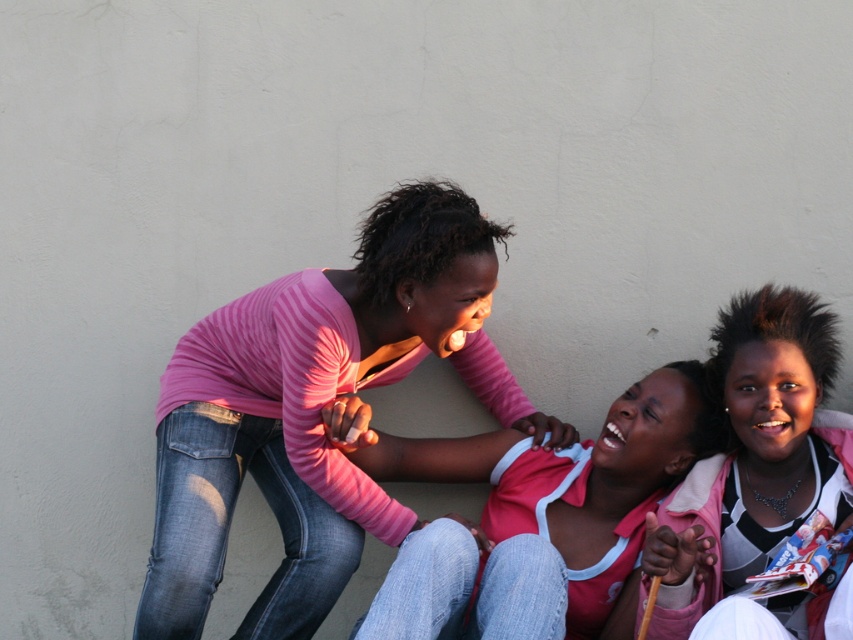
Looking at the scene, which object is taller between the pink matte shirt at center and the pink fabric at center?

The pink fabric at center is taller than the pink matte shirt at center.

You are trying to decide which pink shirt to wear for an event. Both the pink striped shirt at center and the pink matte shirt at center are options. Based on the image, which one is wider?

The pink striped shirt at center is wider than the pink matte shirt at center according to the description.

You are a photographer who wants to capture a closeup of both the pink striped shirt at center and the pink matte shirt at center in the image. Given that your camera can only focus on objects within 12 inches of each other, will you be able to take the photo without moving either subject?

The pink striped shirt at center and pink matte shirt at center are 13.04 inches apart from each other, which is beyond the 12 inch focus range. Therefore, you won t be able to capture both in sharp focus without adjusting their positions.